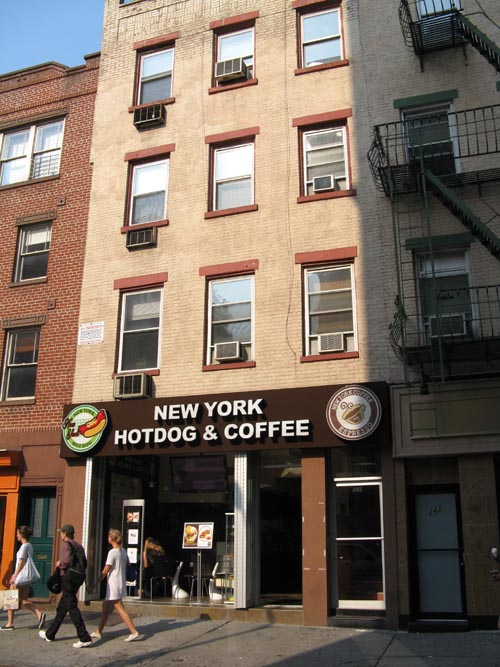
Identify the location of 3rd floor window. The height and width of the screenshot is (667, 500). (438, 133), (331, 157), (227, 193), (156, 205), (29, 267).